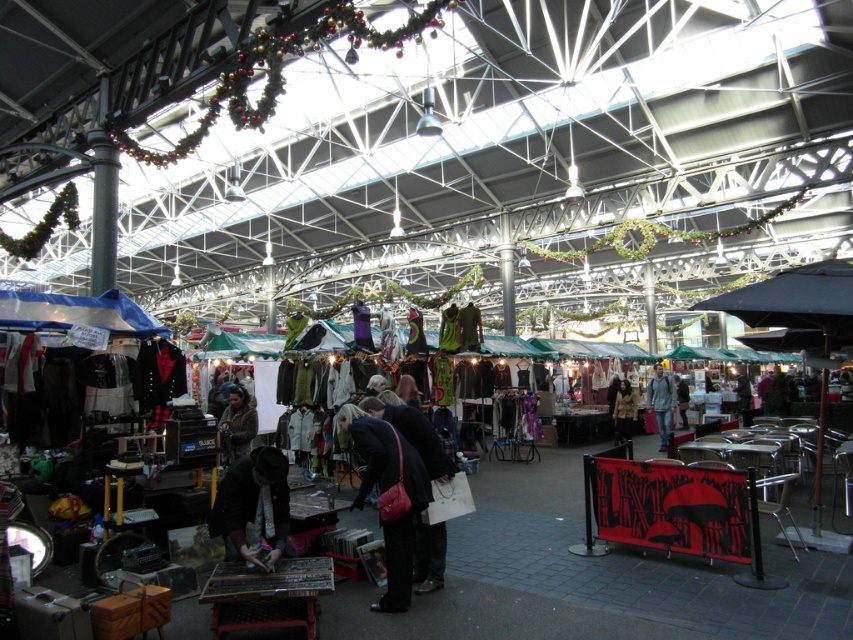
Can you confirm if light gray fabric jacket at center is wider than brown wool coat at center?

Correct, the width of light gray fabric jacket at center exceeds that of brown wool coat at center.

Describe the element at coordinates (660, 403) in the screenshot. I see `light gray fabric jacket at center` at that location.

Locate an element on the screen. light gray fabric jacket at center is located at coordinates (660, 403).

Is point (267, 531) more distant than point (660, 424)?

No, (267, 531) is in front of (660, 424).

Can you confirm if black fabric hat at lower center is thinner than light gray fabric jacket at center?

In fact, black fabric hat at lower center might be wider than light gray fabric jacket at center.

What do you see at coordinates (253, 506) in the screenshot? I see `black fabric hat at lower center` at bounding box center [253, 506].

This screenshot has width=853, height=640. Identify the location of black fabric hat at lower center. pyautogui.click(x=253, y=506).

Describe the element at coordinates (387, 499) in the screenshot. I see `dark blue fabric coat at center` at that location.

Can you confirm if dark blue fabric coat at center is thinner than black fabric hat at lower center?

Incorrect, dark blue fabric coat at center's width is not less than black fabric hat at lower center's.

Who is more forward, (386, 524) or (265, 568)?

Point (265, 568)

Locate an element on the screen. dark blue fabric coat at center is located at coordinates (387, 499).